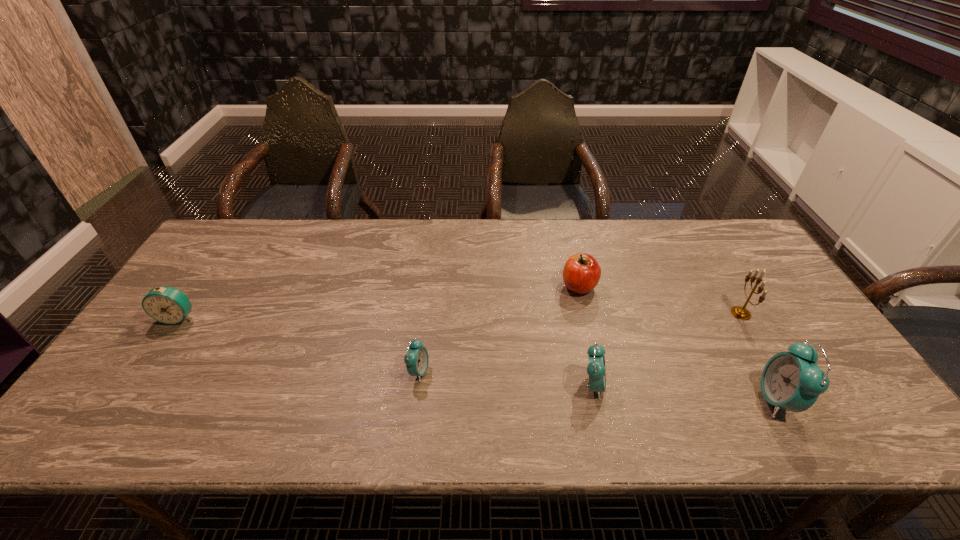
This screenshot has height=540, width=960. What are the coordinates of `the second alarm clock from left to right` in the screenshot? It's located at (417, 359).

Find the location of a particular element. The image size is (960, 540). the second object from left to right is located at coordinates (417, 359).

This screenshot has height=540, width=960. I want to click on the third alarm clock from left to right, so click(x=596, y=370).

This screenshot has width=960, height=540. Identify the location of the tallest alarm clock. (793, 381).

Find the location of a particular element. Image resolution: width=960 pixels, height=540 pixels. candelabrum is located at coordinates (739, 312).

Where is `apple`? The width and height of the screenshot is (960, 540). apple is located at coordinates (581, 274).

Image resolution: width=960 pixels, height=540 pixels. In order to click on the leftmost alarm clock in this screenshot , I will do `click(168, 305)`.

This screenshot has width=960, height=540. In order to click on the leftmost object in this screenshot , I will do `click(168, 305)`.

The image size is (960, 540). I want to click on vacant area located 0.280m on the face of the shortest alarm clock, so click(x=543, y=372).

Identify the location of free spot located on the face of the second alarm clock from right to left. (694, 386).